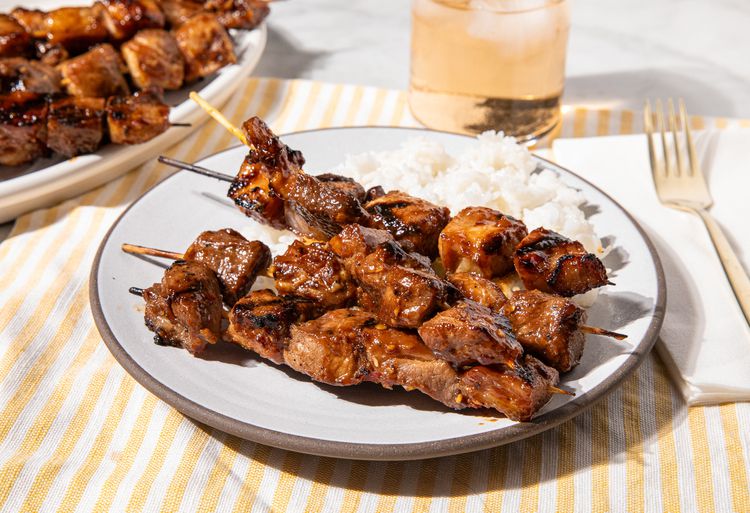
The height and width of the screenshot is (513, 750). What are the coordinates of `napkin` in the screenshot? It's located at pos(676,255).